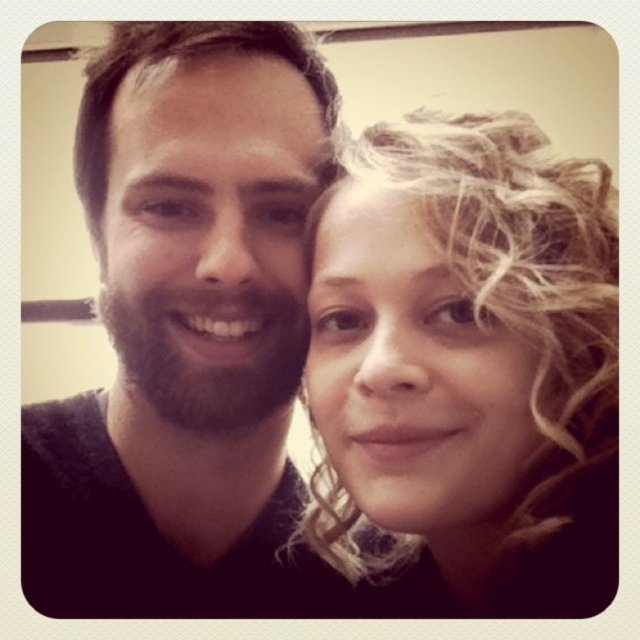
You are a photographer adjusting the lighting for a portrait. You notice two dark brown hair areas in the frame. The first is the dark brown hair at left, and the second is the dark brown curly hair at upper left. Which of these two hair areas is located higher in the image?

The dark brown curly hair at upper left is higher in the image than the dark brown hair at left because the description states that the dark brown hair at left is positioned under the dark brown curly hair at upper left.

You are standing in front of the two people in the image. You want to place a small gift between them such that it is equidistant from both. Given their positions at point coordinates, can you determine if the midpoint between point [467,253] and point [122,60] will be in front of or behind the horizontal object visible behind them?

The midpoint between point [467,253] and point [122,60] would be calculated by averaging their coordinates. The midpoint coordinates would be at 0.246, 0.461. However, since point [467,253] is closer to the viewer than point [122,60], the midpoint would lie between them along the depth axis. This means the midpoint would be behind point [467,253] but in front of point [122,60]. Since the horizontal object is behind both individuals, the midpoint would still be in front of the horizontal

You are an AI analyzing the positioning of people in a photograph. The image shows two people standing together. The person on the left has dark brown hair. Based on the coordinates provided, can you determine the exact 2D location of the dark brown hair at left in the image?

The dark brown hair at left is located at the 2D coordinates point (x=186, y=330).